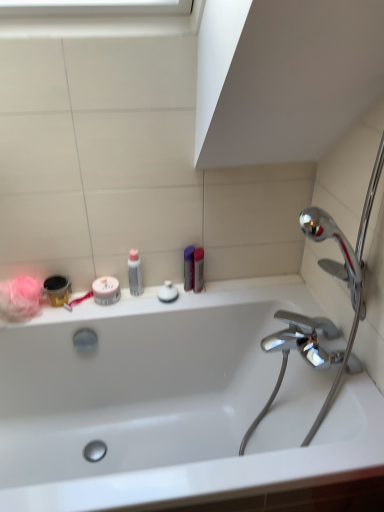
I want to click on blank area to the left of white glossy soap at center, placed as the 2th toiletry when sorted from left to right, so click(x=129, y=307).